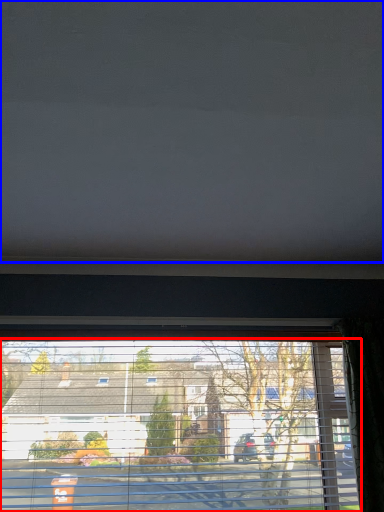
Question: Among these objects, which one is farthest to the camera, window (highlighted by a red box) or blind (highlighted by a blue box)?

Choices:
 (A) window
 (B) blind

Answer: (A)